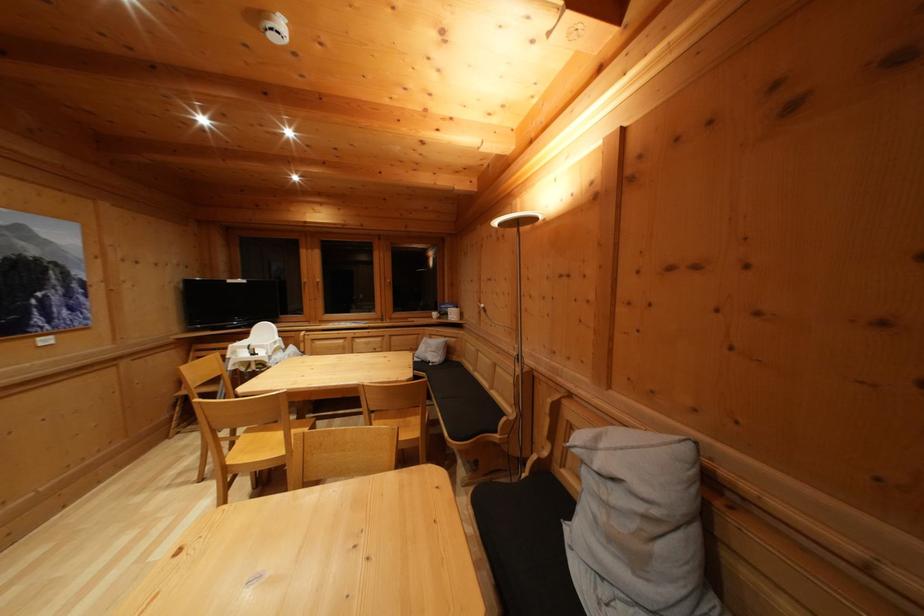
Which object does [638,525] point to?

It corresponds to the grey pillow in the image.